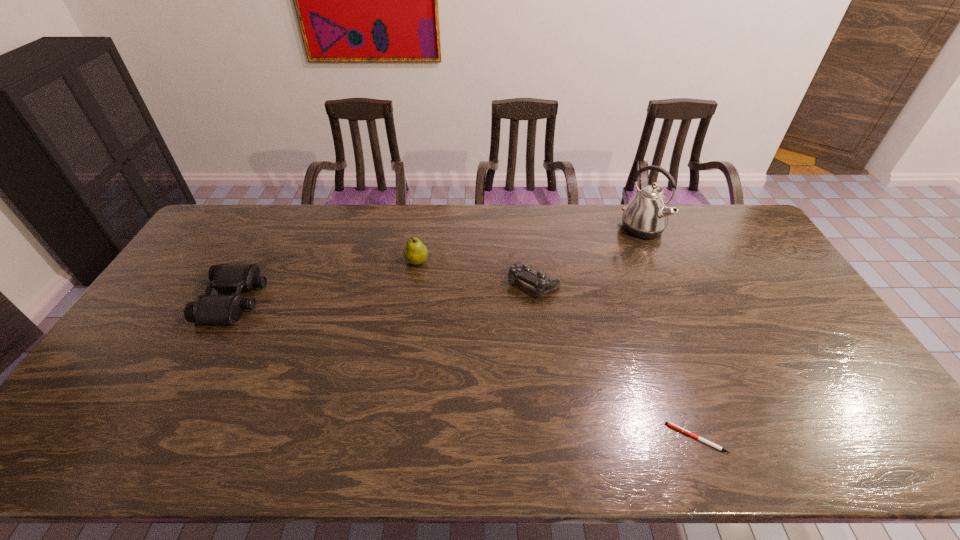
The height and width of the screenshot is (540, 960). I want to click on blank region between the second tallest object and the third object from left to right, so click(x=475, y=273).

Find the location of `unoccupied position between the binoculars and the second tallest object`. unoccupied position between the binoculars and the second tallest object is located at coordinates (326, 281).

This screenshot has height=540, width=960. Identify the location of the fourth closest object relative to the control. (206, 309).

Find the location of a particular element. object that stands as the fourth closest to the control is located at coordinates (206, 309).

Image resolution: width=960 pixels, height=540 pixels. Find the location of `free space that satisfies the following two spatial constraints: 1. on the front side of the kettle; 2. on the clicker of the pen`. free space that satisfies the following two spatial constraints: 1. on the front side of the kettle; 2. on the clicker of the pen is located at coordinates (732, 438).

In order to click on vacant space that satisfies the following two spatial constraints: 1. on the front side of the third object from left to right; 2. through the eyepieces of the leftmost object in this screenshot , I will do pos(536,300).

The height and width of the screenshot is (540, 960). Identify the location of vacant position in the image that satisfies the following two spatial constraints: 1. on the front side of the second tallest object; 2. on the right side of the fourth tallest object. (414, 284).

You are a GUI agent. You are given a task and a screenshot of the screen. Output one action in this format:
    pyautogui.click(x=<x>, y=<y>)
    Task: Click on the vacant space that satisfies the following two spatial constraints: 1. on the back side of the second object from left to right; 2. on the left side of the kettle
    This screenshot has width=960, height=540.
    Given the screenshot: What is the action you would take?
    pyautogui.click(x=422, y=229)